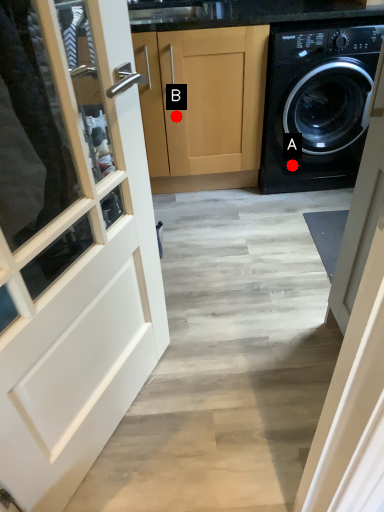
Question: Two points are circled on the image, labeled by A and B beside each circle. Which point appears farthest from the camera in this image?

Choices:
 (A) A is further
 (B) B is further

Answer: (A)